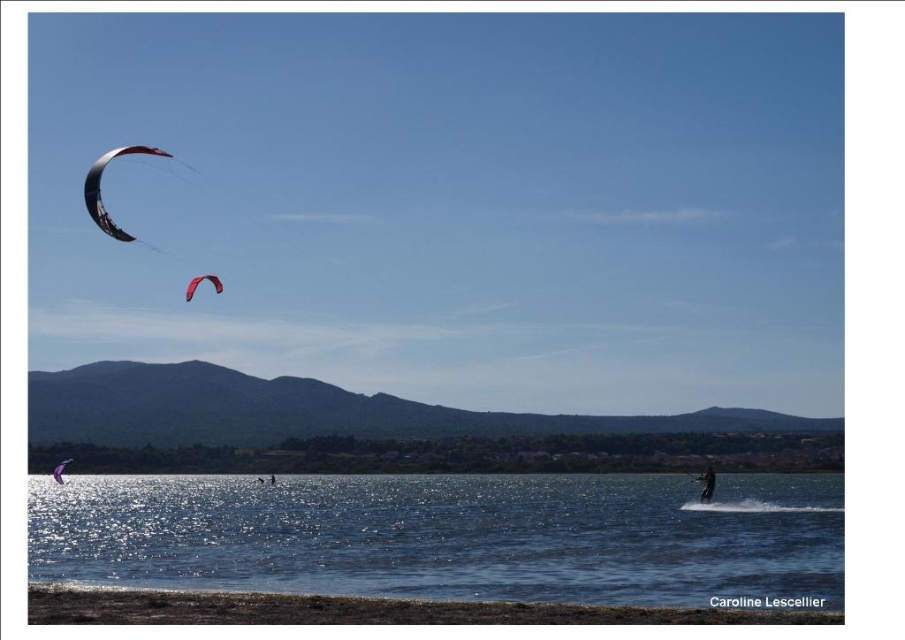
Who is taller, clear blue water at lower center or dark blue wetsuit at lower right?

Standing taller between the two is clear blue water at lower center.

Is point (700, 522) positioned after point (706, 493)?

That is False.

You are a GUI agent. You are given a task and a screenshot of the screen. Output one action in this format:
    pyautogui.click(x=<x>, y=<y>)
    Task: Click on the clear blue water at lower center
    
    Given the screenshot: What is the action you would take?
    pyautogui.click(x=450, y=536)

Can you confirm if matte black kite at upper left is positioned above red matte parachute at upper left?

Correct, matte black kite at upper left is located above red matte parachute at upper left.

Which of these two, matte black kite at upper left or red matte parachute at upper left, stands taller?

Standing taller between the two is matte black kite at upper left.

Locate an element on the screen. The height and width of the screenshot is (640, 905). matte black kite at upper left is located at coordinates (99, 188).

Where is `matte black kite at upper left`? The height and width of the screenshot is (640, 905). matte black kite at upper left is located at coordinates (99, 188).

What do you see at coordinates (100, 189) in the screenshot?
I see `matte black parachute at upper left` at bounding box center [100, 189].

Between matte black parachute at upper left and matte purple kite at lower left, which one has more height?

matte black parachute at upper left

The height and width of the screenshot is (640, 905). Describe the element at coordinates (100, 189) in the screenshot. I see `matte black parachute at upper left` at that location.

The width and height of the screenshot is (905, 640). I want to click on matte black parachute at upper left, so click(x=100, y=189).